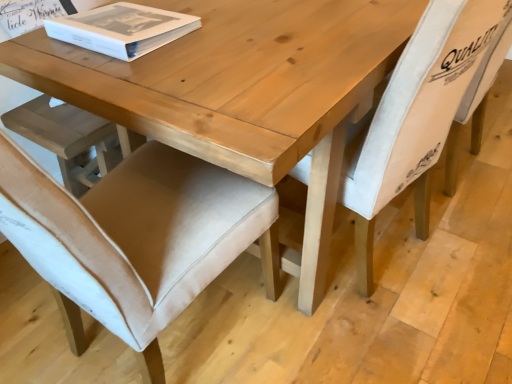
Locate an element on the screen. This screenshot has height=384, width=512. white paper book at upper left is located at coordinates (122, 29).

Locate an element on the screen. The image size is (512, 384). the 2nd chair below the white paper book at upper left (from the image's perspective) is located at coordinates (135, 238).

Based on the photo, is beige fabric chair at lower left, marked as the 1th chair in a left-to-right arrangement, closer to the viewer compared to white paper book at upper left?

Yes, beige fabric chair at lower left, marked as the 1th chair in a left-to-right arrangement, is in front of white paper book at upper left.

Is beige fabric chair at lower left, marked as the 1th chair in a left-to-right arrangement, inside the boundaries of white paper book at upper left, or outside?

beige fabric chair at lower left, marked as the 1th chair in a left-to-right arrangement, is spatially situated outside white paper book at upper left.

Based on the photo, what's the angular difference between beige fabric chair at lower left, the second chair viewed from the right, and white paper book at upper left's facing directions?

The facing directions of beige fabric chair at lower left, the second chair viewed from the right, and white paper book at upper left are 91.6 degrees apart.

Does beige fabric chair at lower left, marked as the 1th chair in a left-to-right arrangement, have a greater width compared to light beige fabric chair at center, which is the second chair from left to right?

Yes, beige fabric chair at lower left, marked as the 1th chair in a left-to-right arrangement, is wider than light beige fabric chair at center, which is the second chair from left to right.

In terms of height, does beige fabric chair at lower left, the second chair viewed from the right, look taller or shorter compared to light beige fabric chair at center, the first chair in the right-to-left sequence?

beige fabric chair at lower left, the second chair viewed from the right, is taller than light beige fabric chair at center, the first chair in the right-to-left sequence.

Consider the image. Which object is positioned more to the left, beige fabric chair at lower left, the second chair viewed from the right, or light beige fabric chair at center, the first chair in the right-to-left sequence?

Positioned to the left is beige fabric chair at lower left, the second chair viewed from the right.

Is point (139, 21) positioned behind point (287, 256)?

No, (139, 21) is in front of (287, 256).

From the image's perspective, does white paper book at upper left appear lower than light beige fabric chair at center, the first chair in the right-to-left sequence?

No, from the image's perspective, white paper book at upper left is not below light beige fabric chair at center, the first chair in the right-to-left sequence.

Where is `box located above the light beige fabric chair at center, which is the second chair from left to right (from a real-world perspective)`? The width and height of the screenshot is (512, 384). box located above the light beige fabric chair at center, which is the second chair from left to right (from a real-world perspective) is located at coordinates (122, 29).

Looking at this image, are white paper book at upper left and light beige fabric chair at center, which is the second chair from left to right, far apart?

No, white paper book at upper left is not far away from light beige fabric chair at center, which is the second chair from left to right.

This screenshot has height=384, width=512. Identify the location of box above the light beige fabric chair at center, which is the second chair from left to right (from a real-world perspective). (122, 29).

Which object is closer to the camera, light beige fabric chair at center, the first chair in the right-to-left sequence, or white paper book at upper left?

light beige fabric chair at center, the first chair in the right-to-left sequence, is closer to the camera.

Who is bigger, light beige fabric chair at center, which is the second chair from left to right, or white paper book at upper left?

Bigger between the two is light beige fabric chair at center, which is the second chair from left to right.

From the picture: Is white paper book at upper left not inside beige fabric chair at lower left, marked as the 1th chair in a left-to-right arrangement?

white paper book at upper left is positioned outside beige fabric chair at lower left, marked as the 1th chair in a left-to-right arrangement.

Which is behind, white paper book at upper left or beige fabric chair at lower left, the second chair viewed from the right?

white paper book at upper left is further away from the camera.

From a real-world perspective, which object rests below the other?

In real-world perspective, beige fabric chair at lower left, the second chair viewed from the right, is lower.

Considering the relative positions of white paper book at upper left and beige fabric chair at lower left, marked as the 1th chair in a left-to-right arrangement, in the image provided, is white paper book at upper left to the left of beige fabric chair at lower left, marked as the 1th chair in a left-to-right arrangement, from the viewer's perspective?

Yes.

Which point is more forward, (450, 122) or (220, 184)?

The point (220, 184) is more forward.

From a real-world perspective, which object rests below the other?

beige fabric chair at lower left, the second chair viewed from the right, from a real-world perspective.

Looking at this image, is light beige fabric chair at center, the first chair in the right-to-left sequence, positioned in front of beige fabric chair at lower left, marked as the 1th chair in a left-to-right arrangement?

No.

Is light beige fabric chair at center, which is the second chair from left to right, to the left of beige fabric chair at lower left, the second chair viewed from the right, from the viewer's perspective?

In fact, light beige fabric chair at center, which is the second chair from left to right, is to the right of beige fabric chair at lower left, the second chair viewed from the right.

This screenshot has height=384, width=512. Identify the location of box on the left of beige fabric chair at lower left, marked as the 1th chair in a left-to-right arrangement. (122, 29).

This screenshot has width=512, height=384. What are the coordinates of `chair located behind the beige fabric chair at lower left, the second chair viewed from the right` in the screenshot? It's located at (421, 112).

Based on their spatial positions, is light beige fabric chair at center, which is the second chair from left to right, or beige fabric chair at lower left, the second chair viewed from the right, further from white paper book at upper left?

Based on the image, light beige fabric chair at center, which is the second chair from left to right, appears to be further to white paper book at upper left.

Based on the photo, which object lies further to the anchor point beige fabric chair at lower left, the second chair viewed from the right, white paper book at upper left or light beige fabric chair at center, the first chair in the right-to-left sequence?

light beige fabric chair at center, the first chair in the right-to-left sequence, is further to beige fabric chair at lower left, the second chair viewed from the right.

From the image, which object appears to be nearer to light beige fabric chair at center, the first chair in the right-to-left sequence, white paper book at upper left or beige fabric chair at lower left, marked as the 1th chair in a left-to-right arrangement?

Based on the image, beige fabric chair at lower left, marked as the 1th chair in a left-to-right arrangement, appears to be nearer to light beige fabric chair at center, the first chair in the right-to-left sequence.

Considering their positions, is light beige fabric chair at center, which is the second chair from left to right, positioned further to beige fabric chair at lower left, the second chair viewed from the right, than white paper book at upper left?

light beige fabric chair at center, which is the second chair from left to right, lies further to beige fabric chair at lower left, the second chair viewed from the right, than the other object.

Looking at the image, which one is located closer to white paper book at upper left, beige fabric chair at lower left, the second chair viewed from the right, or light beige fabric chair at center, the first chair in the right-to-left sequence?

Based on the image, beige fabric chair at lower left, the second chair viewed from the right, appears to be nearer to white paper book at upper left.

Considering their positions, is beige fabric chair at lower left, the second chair viewed from the right, positioned closer to light beige fabric chair at center, the first chair in the right-to-left sequence, than white paper book at upper left?

beige fabric chair at lower left, the second chair viewed from the right, is closer to light beige fabric chair at center, the first chair in the right-to-left sequence.

Locate an element on the screen. This screenshot has height=384, width=512. chair located between white paper book at upper left and light beige fabric chair at center, the first chair in the right-to-left sequence, in the left-right direction is located at coordinates (135, 238).